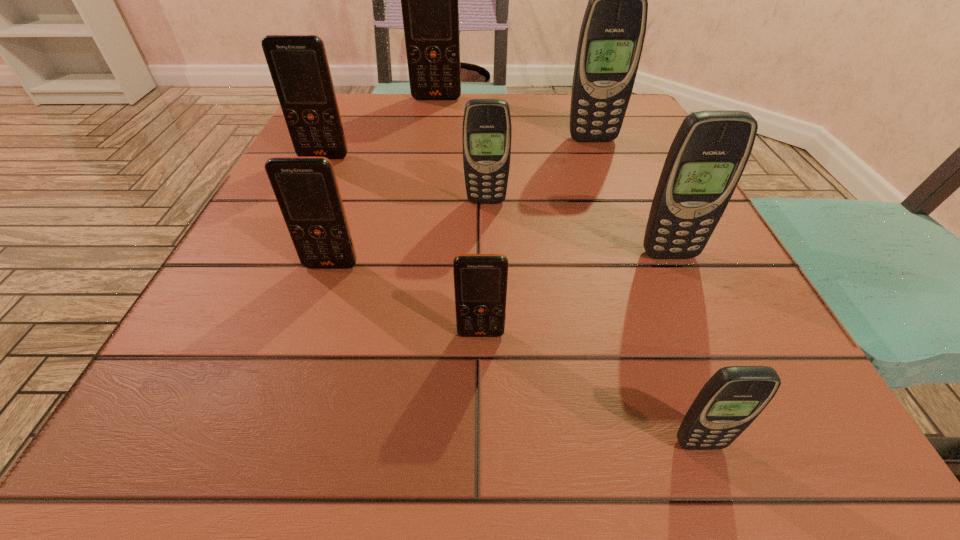
Identify the location of free space located 0.120m on the screen of the fifth nearest object. (487, 250).

Find the location of a particular element. Image resolution: width=960 pixels, height=540 pixels. vacant area situated on the screen of the third biggest orange cellular telephone is located at coordinates (321, 295).

The image size is (960, 540). I want to click on vacant space located on the screen of the seventh farthest cellular telephone, so click(x=481, y=379).

I want to click on object located at the near edge, so click(734, 396).

Find the location of a particular element. The height and width of the screenshot is (540, 960). object that is at the far right corner is located at coordinates pos(612,34).

Find the location of a particular element. The width and height of the screenshot is (960, 540). object positioned at the near right corner is located at coordinates (734, 396).

Where is `vacant space at the far edge`? The image size is (960, 540). vacant space at the far edge is located at coordinates (537, 106).

Identify the location of blank space at the near edge of the desktop. The height and width of the screenshot is (540, 960). (516, 421).

I want to click on free space at the left edge of the desktop, so click(x=182, y=390).

At what (x,y) coordinates should I click in order to perform the action: click on free space at the right edge. Please return your answer as a coordinate pair (x, y). Looking at the image, I should click on (625, 207).